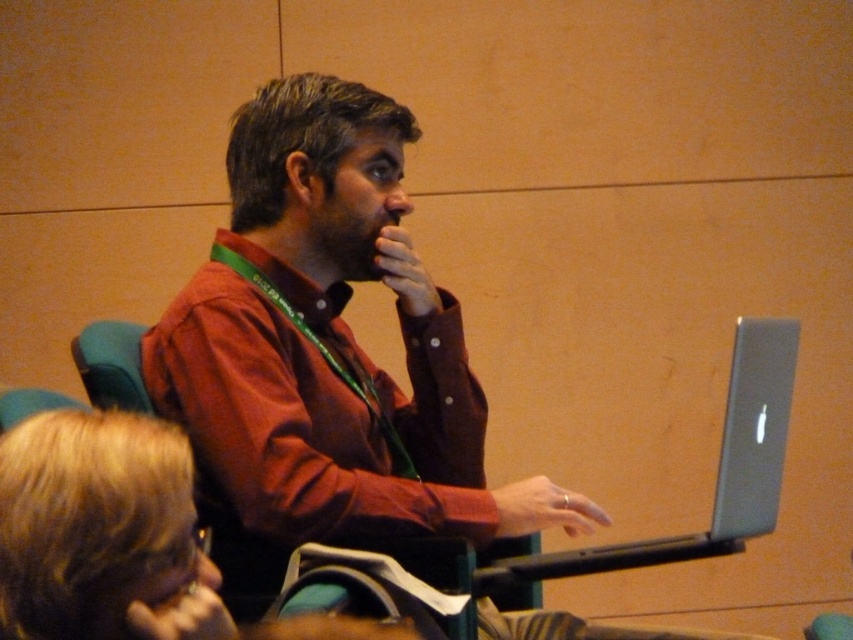
Is matte red shirt at center bigger than silver metallic laptop at right?

Yes.

From the picture: Between matte red shirt at center and silver metallic laptop at right, which one appears on the left side from the viewer's perspective?

matte red shirt at center is more to the left.

The height and width of the screenshot is (640, 853). What do you see at coordinates (329, 342) in the screenshot?
I see `matte red shirt at center` at bounding box center [329, 342].

In order to click on matte red shirt at center in this screenshot , I will do `click(329, 342)`.

The height and width of the screenshot is (640, 853). What are the coordinates of `blonde hair at upper left` in the screenshot? It's located at (93, 522).

Who is positioned more to the right, blonde hair at upper left or blue fabric chair at left?

Positioned to the right is blonde hair at upper left.

Which is in front, point (99, 456) or point (109, 388)?

Positioned in front is point (99, 456).

Locate an element on the screen. This screenshot has width=853, height=640. blonde hair at upper left is located at coordinates (93, 522).

Is matte red shirt at center positioned in front of blue fabric chair at left?

Yes, matte red shirt at center is in front of blue fabric chair at left.

The image size is (853, 640). Describe the element at coordinates (329, 342) in the screenshot. I see `matte red shirt at center` at that location.

Where is `matte red shirt at center`? This screenshot has height=640, width=853. matte red shirt at center is located at coordinates tap(329, 342).